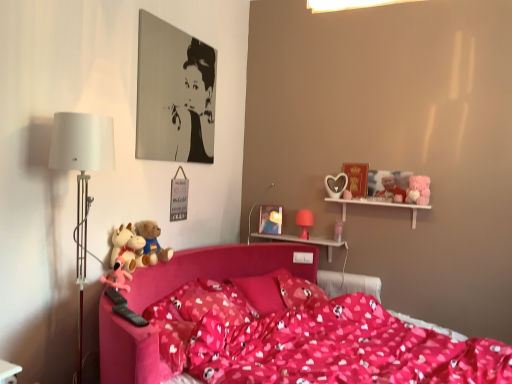
Identify the location of fluffy pink teddy bear at upper right. The image size is (512, 384). (418, 190).

The height and width of the screenshot is (384, 512). What do you see at coordinates (300, 292) in the screenshot? I see `pink fabric pillow at center, the 1th pillow viewed from the back` at bounding box center [300, 292].

In order to face pink fabric pillow at center, acting as the first pillow starting from the front, should I rotate leftwards or rightwards?

You should look left and rotate roughly 4.249 degrees.

Identify the location of matte white lamp at upper center. This screenshot has width=512, height=384. (250, 223).

What are the coordinates of `fluffy pink teddy bear at upper right` in the screenshot? It's located at (418, 190).

From the image's perspective, is matte white lamp at upper center under pink plastic shelf at upper center, marked as the 1th table in a back-to-front arrangement?

No, from the image's perspective, matte white lamp at upper center is not beneath pink plastic shelf at upper center, marked as the 1th table in a back-to-front arrangement.

Based on the photo, from a real-world perspective, is matte white lamp at upper center located beneath pink plastic shelf at upper center, the first table from the top?

Incorrect, from a real-world perspective, matte white lamp at upper center is higher than pink plastic shelf at upper center, the first table from the top.

Is matte white lamp at upper center closer to the viewer compared to pink plastic shelf at upper center, arranged as the 2th table when viewed from the left?

Yes, matte white lamp at upper center is in front of pink plastic shelf at upper center, arranged as the 2th table when viewed from the left.

Who is more distant, matte pink pillow at center, which is the second pillow from back to front, or pink fabric pillow at center, placed as the 3th pillow when sorted from back to front?

Positioned behind is matte pink pillow at center, which is the second pillow from back to front.

In the scene shown: Is matte pink pillow at center, which is the second pillow from back to front, not near pink fabric pillow at center, acting as the first pillow starting from the front?

matte pink pillow at center, which is the second pillow from back to front, is actually quite close to pink fabric pillow at center, acting as the first pillow starting from the front.

From a real-world perspective, is matte pink pillow at center, which is the second pillow from back to front, located higher than pink fabric pillow at center, acting as the first pillow starting from the front?

Actually, matte pink pillow at center, which is the second pillow from back to front, is physically below pink fabric pillow at center, acting as the first pillow starting from the front, in the real world.

Considering their positions, is pink fabric pillow at center, placed as the 3th pillow when sorted from back to front, located in front of or behind fluffy plush toys at left, the 2th toy positioned from the back?

Visually, pink fabric pillow at center, placed as the 3th pillow when sorted from back to front, is located in front of fluffy plush toys at left, the 2th toy positioned from the back.

Where is `the 1st toy to the left when counting from the pink fabric pillow at center, acting as the first pillow starting from the front`? the 1st toy to the left when counting from the pink fabric pillow at center, acting as the first pillow starting from the front is located at coordinates (152, 240).

Does pink fabric pillow at center, placed as the 3th pillow when sorted from back to front, appear on the right side of fluffy plush toys at left, the 2th toy positioned from the back?

Yes.

Based on the photo, how distant is matte plastic picture frame at upper center from smooth plastic santa claus at upper right, positioned as the first toy in right-to-left order?

A distance of 35.92 inches exists between matte plastic picture frame at upper center and smooth plastic santa claus at upper right, positioned as the first toy in right-to-left order.

Is smooth plastic santa claus at upper right, positioned as the first toy in right-to-left order, inside matte plastic picture frame at upper center?

That's incorrect, smooth plastic santa claus at upper right, positioned as the first toy in right-to-left order, is not inside matte plastic picture frame at upper center.

Which object is closer to the camera, matte plastic picture frame at upper center or smooth plastic santa claus at upper right, positioned as the first toy in right-to-left order?

smooth plastic santa claus at upper right, positioned as the first toy in right-to-left order, is in front.

Does matte plastic picture frame at upper center turn towards smooth plastic santa claus at upper right, placed as the 4th toy when sorted from left to right?

No, matte plastic picture frame at upper center is not turned towards smooth plastic santa claus at upper right, placed as the 4th toy when sorted from left to right.

From the picture: Who is taller, matte plastic picture frame at upper center or matte pink pillow at center, which is the second pillow from back to front?

matte plastic picture frame at upper center.

From the image's perspective, is matte plastic picture frame at upper center under matte pink pillow at center, placed as the second pillow when sorted from front to back?

No, from the image's perspective, matte plastic picture frame at upper center is not beneath matte pink pillow at center, placed as the second pillow when sorted from front to back.

Which of these two, matte plastic picture frame at upper center or matte pink pillow at center, which is the second pillow from back to front, is thinner?

matte plastic picture frame at upper center is thinner.

In the image, is matte plastic picture frame at upper center on the left side or the right side of matte pink pillow at center, placed as the second pillow when sorted from front to back?

In the image, matte plastic picture frame at upper center appears on the right side of matte pink pillow at center, placed as the second pillow when sorted from front to back.

Is fluffy pink plush at lower left, which ranks as the second toy in front-to-back order, next to white glossy table at lower left, the first table in the front-to-back sequence, and touching it?

No, fluffy pink plush at lower left, which ranks as the second toy in front-to-back order, is not in contact with white glossy table at lower left, the first table in the front-to-back sequence.

Is fluffy pink plush at lower left, the first toy viewed from the left, facing away from white glossy table at lower left, placed as the first table when sorted from bottom to top?

fluffy pink plush at lower left, the first toy viewed from the left, does not have its back to white glossy table at lower left, placed as the first table when sorted from bottom to top.

Is fluffy pink plush at lower left, the fourth toy when ordered from right to left, wider or thinner than white glossy table at lower left, the first table in the left-to-right sequence?

Considering their sizes, fluffy pink plush at lower left, the fourth toy when ordered from right to left, looks broader than white glossy table at lower left, the first table in the left-to-right sequence.

In the image, is fluffy pink plush at lower left, the fourth toy when ordered from right to left, on the left side or the right side of white glossy table at lower left, the second table positioned from the top?

fluffy pink plush at lower left, the fourth toy when ordered from right to left, is to the right of white glossy table at lower left, the second table positioned from the top.

Considering the positions of point (79, 282) and point (9, 371), is point (79, 282) closer or farther from the camera than point (9, 371)?

Clearly, point (79, 282) is more distant from the camera than point (9, 371).

From the image's perspective, is white fabric lampshade at left, placed as the first table lamp when sorted from front to back, located above white glossy table at lower left, the second table positioned from the top?

Yes, from the image's perspective, white fabric lampshade at left, placed as the first table lamp when sorted from front to back, is over white glossy table at lower left, the second table positioned from the top.

This screenshot has height=384, width=512. What are the coordinates of `the 2nd table located beneath the white fabric lampshade at left, the 2th table lamp positioned from the back (from a real-world perspective)` in the screenshot? It's located at click(x=8, y=372).

At what (x,y) coordinates should I click in order to perform the action: click on table that is the 1st one when counting downward from the matte white lamp at upper center (from the image's perspective). Please return your answer as a coordinate pair (x, y). The height and width of the screenshot is (384, 512). Looking at the image, I should click on (305, 241).

You are a GUI agent. You are given a task and a screenshot of the screen. Output one action in this format:
    pyautogui.click(x=<x>, y=<y>)
    Task: Click on the pillow lying above the matte pink pillow at center, placed as the second pillow when sorted from front to back (from the image's perspective)
    
    Given the screenshot: What is the action you would take?
    pos(212,302)

Considering their positions, is pink fabric pillow at center, which is the 3th pillow from front to back, positioned further to matte plastic picture frame at upper center than pink rubber duck at left, acting as the 3th toy starting from the right?

pink rubber duck at left, acting as the 3th toy starting from the right, lies further to matte plastic picture frame at upper center than the other object.

Based on their spatial positions, is pink matte table lamp at upper right, which is counted as the 1th table lamp, starting from the right, or white wooden shelf at upper right further from fluffy pink plush at lower left, the first toy viewed from the left?

white wooden shelf at upper right.

Considering their positions, is pink fabric bed at center positioned further to pink fabric pillow at center, placed as the 3th pillow when sorted from back to front, than pink matte table lamp at upper right, which is the second table lamp from front to back?

pink matte table lamp at upper right, which is the second table lamp from front to back, lies further to pink fabric pillow at center, placed as the 3th pillow when sorted from back to front, than the other object.

Looking at the image, which one is located further to fluffy pink teddy bear at upper right, fluffy pink plush at lower left, the third toy in the back-to-front sequence, or smooth plastic santa claus at upper right, which ranks as the fourth toy in front-to-back order?

fluffy pink plush at lower left, the third toy in the back-to-front sequence, is positioned further to the anchor fluffy pink teddy bear at upper right.

From the image, which object appears to be farther from matte plastic picture frame at upper center, pink matte table lamp at upper right, positioned as the second table lamp in left-to-right order, or pink rubber duck at left, positioned as the 1th toy in front-to-back order?

pink rubber duck at left, positioned as the 1th toy in front-to-back order.

From the image, which object appears to be nearer to pink fabric pillow at center, acting as the first pillow starting from the front, pink fabric pillow at center, which is the 3th pillow from front to back, or matte pink pillow at center, placed as the second pillow when sorted from front to back?

Based on the image, matte pink pillow at center, placed as the second pillow when sorted from front to back, appears to be nearer to pink fabric pillow at center, acting as the first pillow starting from the front.

Which object lies nearer to the anchor point pink rubber duck at left, the 2th toy positioned from the left, fluffy pink plush at lower left, which ranks as the second toy in front-to-back order, or pink plastic shelf at upper center, marked as the 1th table in a back-to-front arrangement?

Based on the image, fluffy pink plush at lower left, which ranks as the second toy in front-to-back order, appears to be nearer to pink rubber duck at left, the 2th toy positioned from the left.

Which object lies further to the anchor point pink fabric pillow at center, which is the 3th pillow from front to back, white glossy table at lower left, the second table viewed from the back, or pink matte table lamp at upper right, positioned as the second table lamp in left-to-right order?

white glossy table at lower left, the second table viewed from the back, lies further to pink fabric pillow at center, which is the 3th pillow from front to back, than the other object.

At what (x,y) coordinates should I click in order to perform the action: click on shelf situated between white fabric lampshade at left, placed as the second table lamp when sorted from right to left, and fluffy pink teddy bear at upper right from left to right. Please return your answer as a coordinate pair (x, y). The image size is (512, 384). Looking at the image, I should click on (379, 205).

Find the location of a particular element. This screenshot has height=384, width=512. bed between fluffy pink plush at lower left, the third toy in the back-to-front sequence, and fluffy pink teddy bear at upper right is located at coordinates (275, 329).

Identify the location of table between white fabric lampshade at left, which ranks as the 1th table lamp in left-to-right order, and pink matte table lamp at upper right, positioned as the second table lamp in left-to-right order, in the front-back direction. (305, 241).

Where is `pillow between matte plastic picture frame at upper center and smooth plastic santa claus at upper right, placed as the 4th toy when sorted from left to right, in the horizontal direction`? This screenshot has height=384, width=512. pillow between matte plastic picture frame at upper center and smooth plastic santa claus at upper right, placed as the 4th toy when sorted from left to right, in the horizontal direction is located at coordinates (300, 292).